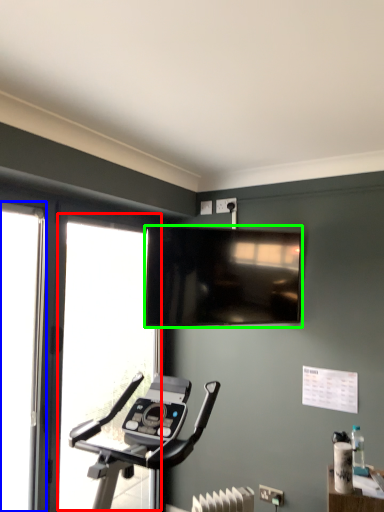
Question: Which is nearer to the window (highlighted by a red box)? screen door (highlighted by a blue box) or television (highlighted by a green box).

Choices:
 (A) screen door
 (B) television

Answer: (A)